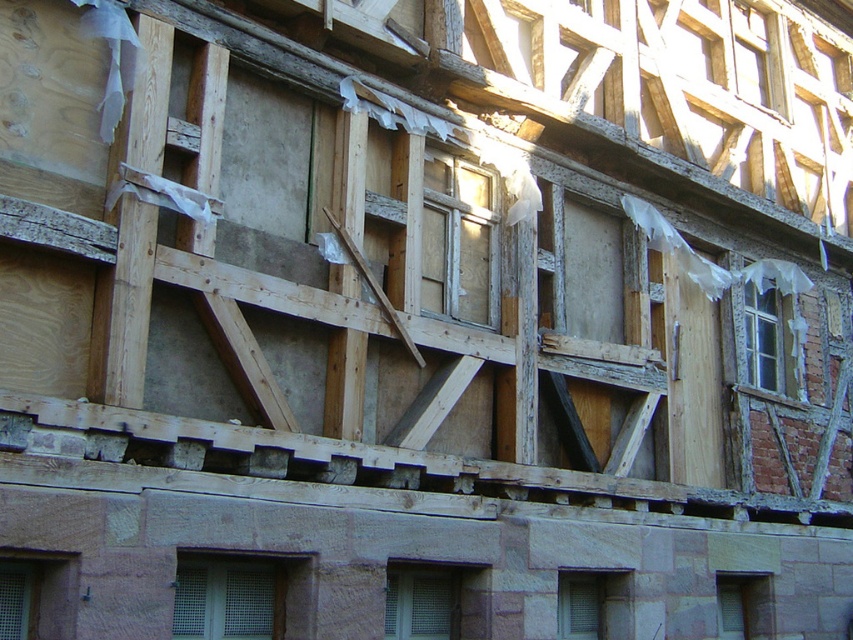
Which is behind, point (263, 579) or point (625, 632)?

The point (625, 632) is more distant.

From the picture: Does metallic mesh window at lower center have a larger size compared to matte gray wooden window at center?

Yes, metallic mesh window at lower center is bigger than matte gray wooden window at center.

Is point (236, 561) positioned in front of point (604, 616)?

Yes, it is.

Find the location of a particular element. The height and width of the screenshot is (640, 853). metallic mesh window at lower center is located at coordinates pyautogui.click(x=241, y=596).

Between metallic mesh window at lower center and transparent plastic window at center right, which one appears on the left side from the viewer's perspective?

From the viewer's perspective, metallic mesh window at lower center appears more on the left side.

Is point (180, 621) closer to viewer compared to point (770, 280)?

Yes, it is.

This screenshot has height=640, width=853. Describe the element at coordinates (241, 596) in the screenshot. I see `metallic mesh window at lower center` at that location.

Find the location of a particular element. metallic mesh window at lower center is located at coordinates (241, 596).

Who is shorter, metallic mesh window at lower center or matte stone window at lower right?

Standing shorter between the two is metallic mesh window at lower center.

Is the position of metallic mesh window at lower center more distant than that of matte stone window at lower right?

No.

Is point (248, 573) farther from viewer compared to point (741, 636)?

No, it is not.

The width and height of the screenshot is (853, 640). Find the location of `metallic mesh window at lower center`. metallic mesh window at lower center is located at coordinates (241, 596).